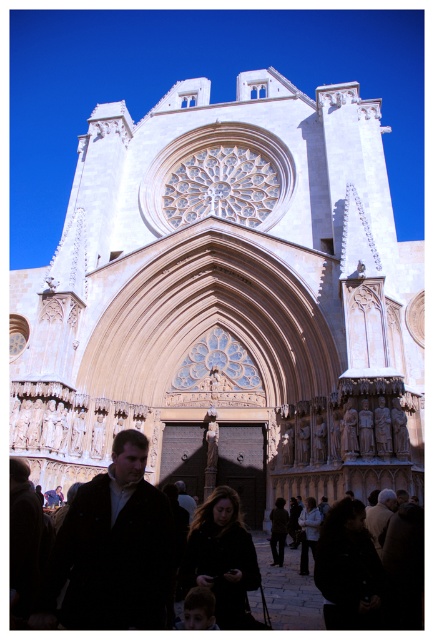
Question: Which point appears farthest from the camera in this image?

Choices:
 (A) (170, 572)
 (B) (134, 236)

Answer: (B)

Question: Which point is farther to the camera?

Choices:
 (A) dark brown leather jacket at lower left
 (B) beige stone church at center
 (C) black fabric crowd at lower center

Answer: (B)

Question: Is beige stone church at center below black fabric crowd at lower center?

Choices:
 (A) yes
 (B) no

Answer: (B)

Question: Among these objects, which one is nearest to the camera?

Choices:
 (A) black fabric crowd at lower center
 (B) dark brown leather jacket at lower left
 (C) beige stone church at center

Answer: (B)

Question: Is dark brown leather jacket at lower left further to the viewer compared to black fabric crowd at lower center?

Choices:
 (A) yes
 (B) no

Answer: (B)

Question: Does dark brown leather jacket at lower left appear under black fabric crowd at lower center?

Choices:
 (A) yes
 (B) no

Answer: (B)